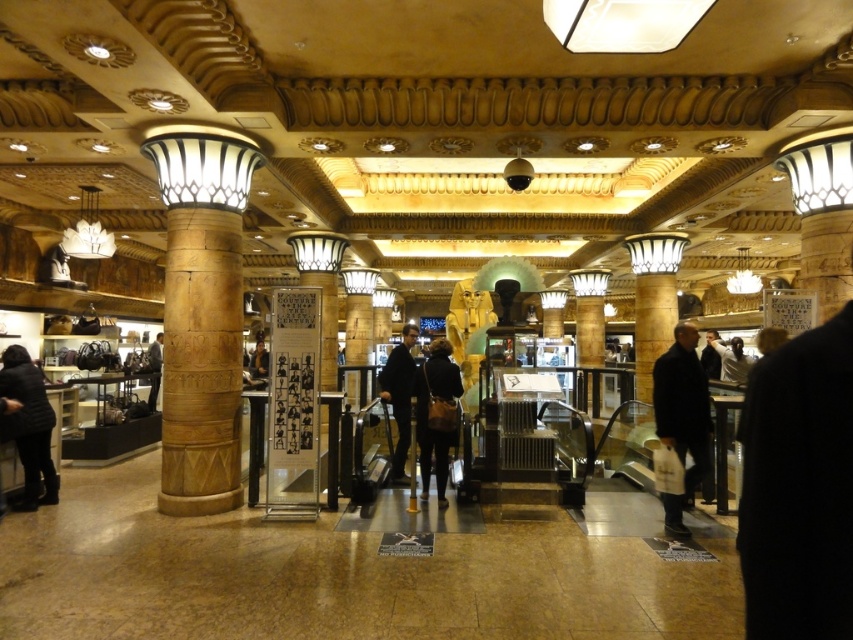
Question: Can you confirm if wooden column at left is positioned below dark brown leather bag at center?

Choices:
 (A) yes
 (B) no

Answer: (B)

Question: Among these objects, which one is farthest from the camera?

Choices:
 (A) wooden column at left
 (B) dark blue fabric coat at center
 (C) golden stone column at upper right
 (D) polished stone column at center

Answer: (D)

Question: Is golden stone column at upper right wider than white matte shirt at upper right?

Choices:
 (A) yes
 (B) no

Answer: (B)

Question: Which of these objects is positioned farthest from the wooden column at left?

Choices:
 (A) dark blue fabric coat at center
 (B) dark brown leather jacket at left

Answer: (B)

Question: Which point is farther to the camera?

Choices:
 (A) (207, 339)
 (B) (337, 243)
 (C) (395, 416)

Answer: (B)

Question: Does gold polished pillar at center have a lesser width compared to dark brown leather jacket at left?

Choices:
 (A) no
 (B) yes

Answer: (B)